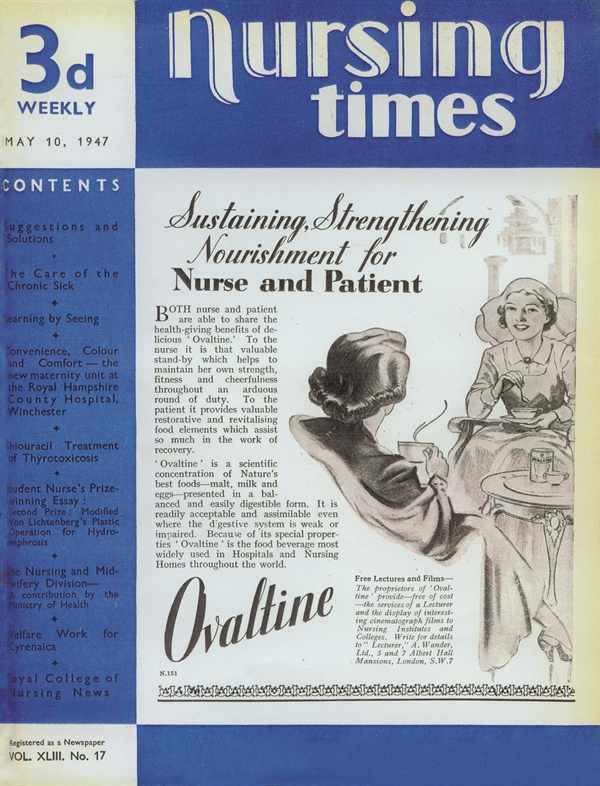
In order to click on table leg in this screenshot , I will do (547, 538).